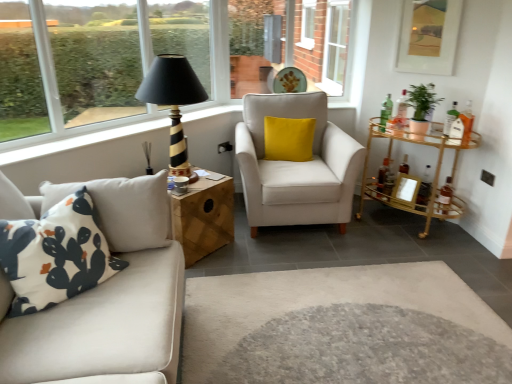
Question: Is gold metallic bar cart at right, which is the 2th table in left-to-right order, beside white printed cushion at left, the second pillow when ordered from top to bottom?

Choices:
 (A) no
 (B) yes

Answer: (A)

Question: Is gold metallic bar cart at right, positioned as the first table in right-to-left order, taller than white printed cushion at left, which appears as the second pillow when viewed from the right?

Choices:
 (A) no
 (B) yes

Answer: (B)

Question: Considering the relative sizes of gold metallic bar cart at right, positioned as the first table in right-to-left order, and white printed cushion at left, the 2th pillow in the back-to-front sequence, in the image provided, is gold metallic bar cart at right, positioned as the first table in right-to-left order, wider than white printed cushion at left, the 2th pillow in the back-to-front sequence,?

Choices:
 (A) no
 (B) yes

Answer: (B)

Question: From a real-world perspective, is gold metallic bar cart at right, positioned as the first table in right-to-left order, under white printed cushion at left, the second pillow when ordered from top to bottom?

Choices:
 (A) yes
 (B) no

Answer: (A)

Question: Is gold metallic bar cart at right, positioned as the first table in right-to-left order, outside of white printed cushion at left, the second pillow when ordered from top to bottom?

Choices:
 (A) no
 (B) yes

Answer: (B)

Question: Considering the positions of gold metallic bar cart at right, which is the 2th table in left-to-right order, and matte gold picture frame at upper right, which is the 2th picture frame in bottom-to-top order, in the image, is gold metallic bar cart at right, which is the 2th table in left-to-right order, wider or thinner than matte gold picture frame at upper right, which is the 2th picture frame in bottom-to-top order,?

Choices:
 (A) thin
 (B) wide

Answer: (B)

Question: Is gold metallic bar cart at right, positioned as the first table in right-to-left order, bigger or smaller than matte gold picture frame at upper right, which is the 2th picture frame in bottom-to-top order?

Choices:
 (A) big
 (B) small

Answer: (A)

Question: From the image's perspective, is gold metallic bar cart at right, which is the 2th table in left-to-right order, positioned above or below matte gold picture frame at upper right, which is the 2th picture frame in bottom-to-top order?

Choices:
 (A) above
 (B) below

Answer: (B)

Question: From a real-world perspective, is gold metallic bar cart at right, which is the 2th table in left-to-right order, physically located above or below matte gold picture frame at upper right, which ranks as the 1th picture frame in top-to-bottom order?

Choices:
 (A) below
 (B) above

Answer: (A)

Question: Based on their positions, is green matte plant at upper right located to the left or right of white fabric armchair at center?

Choices:
 (A) left
 (B) right

Answer: (B)

Question: Is point [x=411, y=122] closer or farther from the camera than point [x=349, y=218]?

Choices:
 (A) closer
 (B) farther

Answer: (A)

Question: Considering their positions, is green matte plant at upper right located in front of or behind white fabric armchair at center?

Choices:
 (A) behind
 (B) front

Answer: (A)

Question: Choose the correct answer: Is green matte plant at upper right inside white fabric armchair at center or outside it?

Choices:
 (A) inside
 (B) outside

Answer: (B)

Question: Is white printed cushion at left, marked as the 1th pillow in a bottom-to-top arrangement, inside the boundaries of matte gold picture frame at upper right, which is the 2th picture frame in bottom-to-top order, or outside?

Choices:
 (A) inside
 (B) outside

Answer: (B)

Question: From a real-world perspective, is white printed cushion at left, which appears as the second pillow when viewed from the right, physically located above or below matte gold picture frame at upper right, which ranks as the 1th picture frame in top-to-bottom order?

Choices:
 (A) above
 (B) below

Answer: (B)